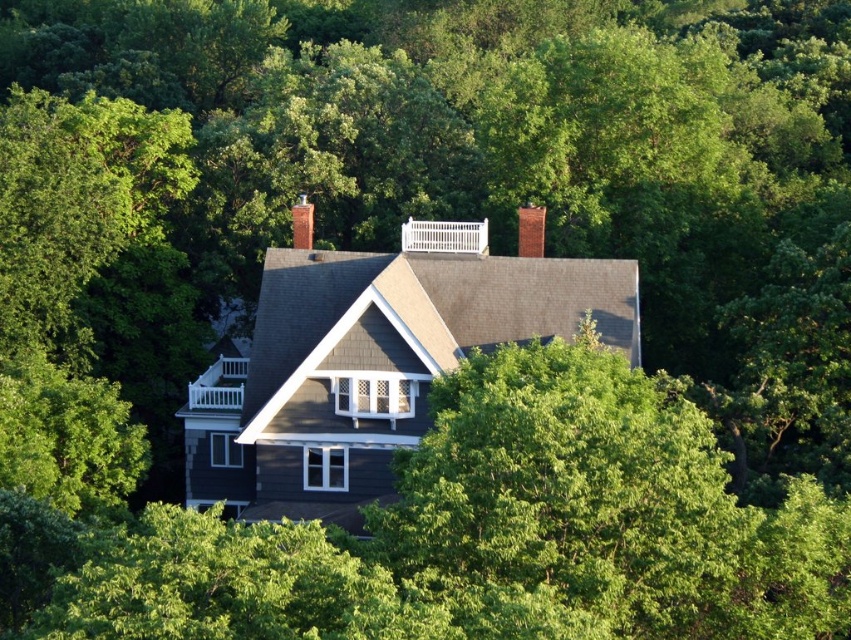
Consider the image. Who is shorter, red brick chimney at upper center or brick chimney at center?

Standing shorter between the two is red brick chimney at upper center.

Measure the distance between point (x=524, y=224) and camera.

They are 70.35 meters apart.

Does point (528, 241) come farther from viewer compared to point (297, 212)?

That is False.

Where is `red brick chimney at upper center`? The height and width of the screenshot is (640, 851). red brick chimney at upper center is located at coordinates coord(530,230).